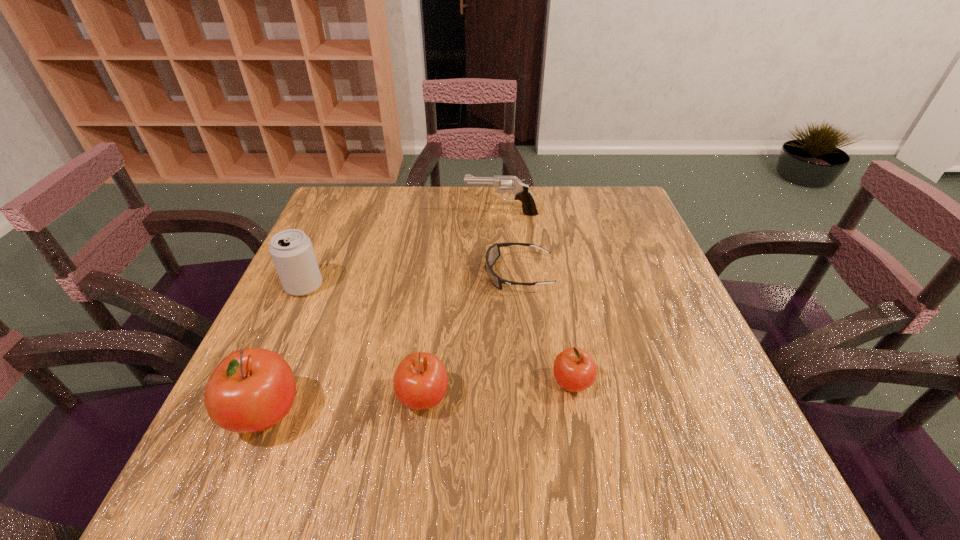
Please point a free position for a apple on the right. Please provide its 2D coordinates. Your answer should be formatted as a tuple, i.e. [(x, y)], where the tuple contains the x and y coordinates of a point satisfying the conditions above.

[(712, 369)]